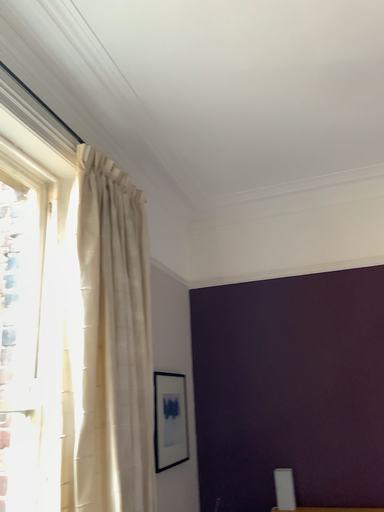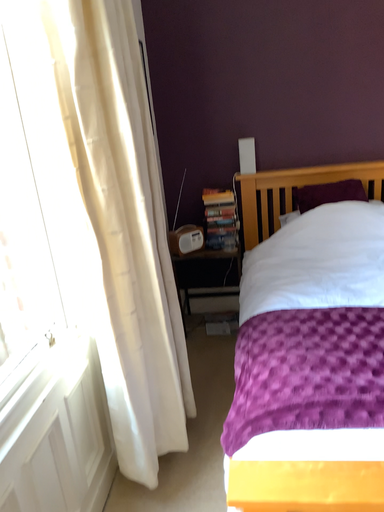
Question: Which way did the camera rotate in the video?

Choices:
 (A) rotated left
 (B) rotated right

Answer: (B)